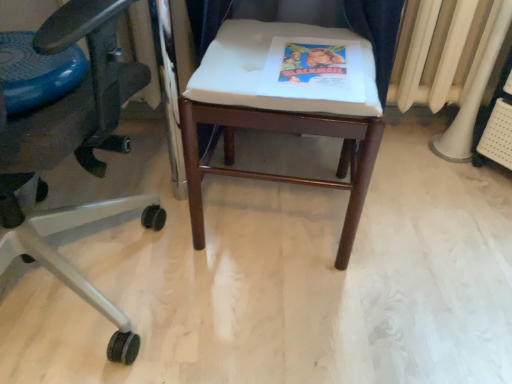
Where is `unoccupied area behind white plastic radiator at right`? unoccupied area behind white plastic radiator at right is located at coordinates (426, 132).